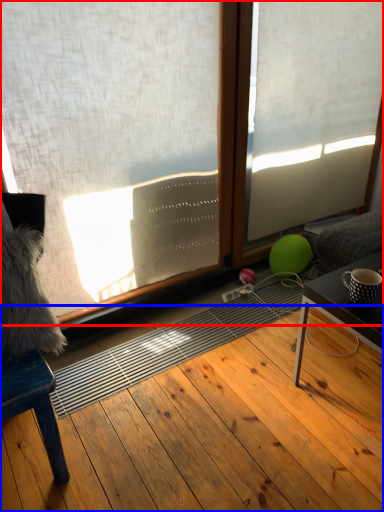
Question: Among these objects, which one is nearest to the camera, window (highlighted by a red box) or hardwood (highlighted by a blue box)?

Choices:
 (A) window
 (B) hardwood

Answer: (B)